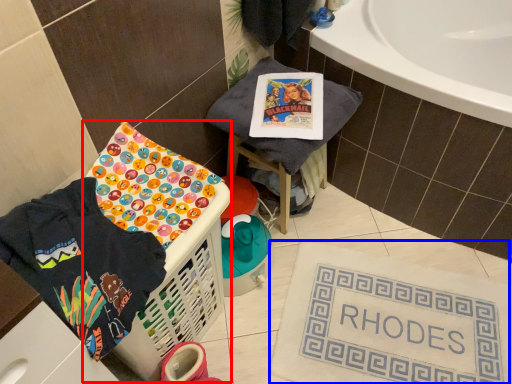
Question: Which object appears closest to the camera in this image, basket container (highlighted by a red box) or bath mat (highlighted by a blue box)?

Choices:
 (A) basket container
 (B) bath mat

Answer: (A)